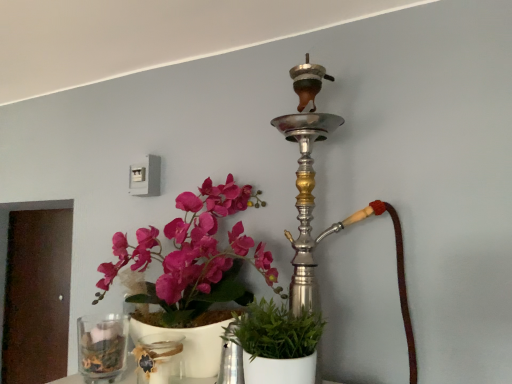
Question: Is clear glass vase at lower left in front of or behind green matte plant at center in the image?

Choices:
 (A) front
 (B) behind

Answer: (B)

Question: Which is correct: clear glass vase at lower left is inside green matte plant at center, or outside of it?

Choices:
 (A) outside
 (B) inside

Answer: (A)

Question: Which is farther from the transparent glass jar at lower center?

Choices:
 (A) clear glass vase at lower left
 (B) silver metallic hookah at upper center
 (C) green matte plant at center

Answer: (B)

Question: Estimate the real-world distances between objects in this image. Which object is farther from the silver metallic hookah at upper center?

Choices:
 (A) transparent glass jar at lower center
 (B) green matte plant at center
 (C) clear glass vase at lower left

Answer: (C)